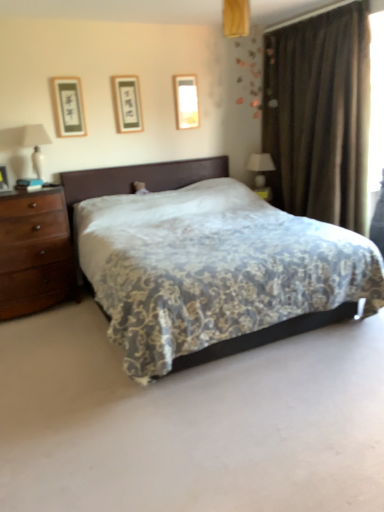
Describe the element at coordinates (208, 263) in the screenshot. I see `floral-patterned fabric bed at center` at that location.

From the picture: How much space does matte glass picture frame at upper center, arranged as the 1th picture frame when viewed from the right, occupy vertically?

It is 20.49 inches.

Locate an element on the screen. Image resolution: width=384 pixels, height=512 pixels. white ceramic table lamp at left, placed as the 1th table lamp when sorted from left to right is located at coordinates (35, 145).

Find the location of a particular element. The height and width of the screenshot is (512, 384). white glossy table lamp at upper right, which is counted as the second table lamp, starting from the left is located at coordinates (260, 167).

At what (x,y) coordinates should I click in order to perform the action: click on matte black picture frame at upper left, marked as the third picture frame in a right-to-left arrangement. Please return your answer as a coordinate pair (x, y). Looking at the image, I should click on (69, 106).

From the image's perspective, is white ceramic table lamp at left, which ranks as the first table lamp in front-to-back order, under floral-patterned fabric bed at center?

No, from the image's perspective, white ceramic table lamp at left, which ranks as the first table lamp in front-to-back order, is not beneath floral-patterned fabric bed at center.

How many degrees apart are the facing directions of white ceramic table lamp at left, the 2th table lamp from the back, and floral-patterned fabric bed at center?

The angular difference between white ceramic table lamp at left, the 2th table lamp from the back, and floral-patterned fabric bed at center is 3.81 degrees.

Is white ceramic table lamp at left, marked as the 2th table lamp in a right-to-left arrangement, oriented away from floral-patterned fabric bed at center?

white ceramic table lamp at left, marked as the 2th table lamp in a right-to-left arrangement, does not have its back to floral-patterned fabric bed at center.

Can you confirm if white ceramic table lamp at left, marked as the 2th table lamp in a right-to-left arrangement, is taller than floral-patterned fabric bed at center?

No.

Which object is further away from the camera, matte glass picture frame at upper center, arranged as the 1th picture frame when viewed from the right, or matte black picture frame at upper left, marked as the third picture frame in a right-to-left arrangement?

matte glass picture frame at upper center, arranged as the 1th picture frame when viewed from the right, is further from the camera.

Is matte glass picture frame at upper center, arranged as the 1th picture frame when viewed from the right, oriented away from matte black picture frame at upper left, marked as the third picture frame in a right-to-left arrangement?

matte glass picture frame at upper center, arranged as the 1th picture frame when viewed from the right, does not have its back to matte black picture frame at upper left, marked as the third picture frame in a right-to-left arrangement.

Measure the distance between matte glass picture frame at upper center, placed as the 3th picture frame when sorted from front to back, and matte black picture frame at upper left, marked as the third picture frame in a right-to-left arrangement.

matte glass picture frame at upper center, placed as the 3th picture frame when sorted from front to back, is 3.60 feet from matte black picture frame at upper left, marked as the third picture frame in a right-to-left arrangement.

From the image's perspective, which object appears higher, matte glass picture frame at upper center, arranged as the 1th picture frame when viewed from the right, or matte black picture frame at upper left, placed as the first picture frame when sorted from left to right?

matte glass picture frame at upper center, arranged as the 1th picture frame when viewed from the right, is shown above in the image.

Considering the sizes of objects black paper picture frame at upper center, placed as the 2th picture frame when sorted from left to right, and floral-patterned fabric bed at center in the image provided, who is bigger, black paper picture frame at upper center, placed as the 2th picture frame when sorted from left to right, or floral-patterned fabric bed at center?

floral-patterned fabric bed at center is bigger.

Are black paper picture frame at upper center, the 2th picture frame in the front-to-back sequence, and floral-patterned fabric bed at center far apart?

Yes.

Is point (130, 129) farther from viewer compared to point (202, 232)?

Yes, it is behind point (202, 232).

From a real-world perspective, is black paper picture frame at upper center, the 2th picture frame in the front-to-back sequence, above or below floral-patterned fabric bed at center?

black paper picture frame at upper center, the 2th picture frame in the front-to-back sequence, is above floral-patterned fabric bed at center.

Looking at the image, does matte black picture frame at upper left, marked as the third picture frame in a right-to-left arrangement, seem bigger or smaller compared to floral-patterned fabric bed at center?

matte black picture frame at upper left, marked as the third picture frame in a right-to-left arrangement, is smaller than floral-patterned fabric bed at center.

From a real-world perspective, which object stands above the other?

From a 3D spatial view, matte black picture frame at upper left, acting as the first picture frame starting from the front, is above.

Is point (85, 123) closer or farther from the camera than point (131, 309)?

Point (85, 123) is positioned farther from the camera compared to point (131, 309).

Is point (130, 88) in front of point (356, 207)?

No, (130, 88) is behind (356, 207).

Is brown velvet curtain at right inside black paper picture frame at upper center, the second picture frame viewed from the back?

No.

Which of these two, black paper picture frame at upper center, the 2th picture frame in the front-to-back sequence, or brown velvet curtain at right, is wider?

brown velvet curtain at right is wider.

From a real-world perspective, which is physically below, black paper picture frame at upper center, placed as the 2th picture frame when sorted from left to right, or brown velvet curtain at right?

brown velvet curtain at right is physically lower.

Considering the points (267, 156) and (95, 266), which point is behind, point (267, 156) or point (95, 266)?

The point (267, 156) is farther.

Is floral-patterned fabric bed at center at the back of white glossy table lamp at upper right, which is counted as the second table lamp, starting from the left?

No, white glossy table lamp at upper right, which is counted as the second table lamp, starting from the left, is not facing away from floral-patterned fabric bed at center.

In terms of height, does white glossy table lamp at upper right, which appears as the 2th table lamp when viewed from the front, look taller or shorter compared to floral-patterned fabric bed at center?

Clearly, white glossy table lamp at upper right, which appears as the 2th table lamp when viewed from the front, is shorter compared to floral-patterned fabric bed at center.

Who is more distant, white glossy table lamp at upper right, which appears as the 2th table lamp when viewed from the front, or floral-patterned fabric bed at center?

white glossy table lamp at upper right, which appears as the 2th table lamp when viewed from the front, is further from the camera.

From a real-world perspective, who is located lower, brown velvet curtain at right or white glossy table lamp at upper right, which is counted as the second table lamp, starting from the left?

From a 3D spatial view, white glossy table lamp at upper right, which is counted as the second table lamp, starting from the left, is below.

Is brown velvet curtain at right in contact with white glossy table lamp at upper right, which is counted as the second table lamp, starting from the left?

There is a gap between brown velvet curtain at right and white glossy table lamp at upper right, which is counted as the second table lamp, starting from the left.

Would you say brown velvet curtain at right is inside or outside white glossy table lamp at upper right, which is counted as the second table lamp, starting from the left?

A: brown velvet curtain at right is not inside white glossy table lamp at upper right, which is counted as the second table lamp, starting from the left, it's outside.

Which is closer to the camera, (311, 201) or (266, 153)?

Point (311, 201) is closer to the camera than point (266, 153).

Find the location of a particular element. This screenshot has width=384, height=512. bed that is under the white ceramic table lamp at left, marked as the 2th table lamp in a right-to-left arrangement (from a real-world perspective) is located at coordinates (208, 263).

What are the coordinates of `picture frame that is the 2nd object located below the matte glass picture frame at upper center, arranged as the 3th picture frame when viewed from the left (from the image's perspective)` in the screenshot? It's located at (69, 106).

When comparing their distances from brown velvet curtain at right, does matte black picture frame at upper left, marked as the third picture frame in a right-to-left arrangement, or white glossy table lamp at upper right, which is the first table lamp in right-to-left order, seem closer?

white glossy table lamp at upper right, which is the first table lamp in right-to-left order, is closer to brown velvet curtain at right.

Looking at the image, which one is located further to black paper picture frame at upper center, acting as the second picture frame starting from the right, floral-patterned fabric bed at center or matte glass picture frame at upper center, which is the 1th picture frame from back to front?

floral-patterned fabric bed at center lies further to black paper picture frame at upper center, acting as the second picture frame starting from the right, than the other object.

Estimate the real-world distances between objects in this image. Which object is closer to brown velvet curtain at right, white ceramic table lamp at left, which ranks as the first table lamp in front-to-back order, or matte black picture frame at upper left, placed as the first picture frame when sorted from left to right?

Based on the image, matte black picture frame at upper left, placed as the first picture frame when sorted from left to right, appears to be nearer to brown velvet curtain at right.

Based on their spatial positions, is white ceramic table lamp at left, which ranks as the first table lamp in front-to-back order, or black paper picture frame at upper center, the second picture frame viewed from the back, further from brown velvet curtain at right?

Among the two, white ceramic table lamp at left, which ranks as the first table lamp in front-to-back order, is located further to brown velvet curtain at right.

Based on their spatial positions, is brown velvet curtain at right or matte black picture frame at upper left, the 3th picture frame when ordered from back to front, further from white ceramic table lamp at left, which ranks as the first table lamp in front-to-back order?

Among the two, brown velvet curtain at right is located further to white ceramic table lamp at left, which ranks as the first table lamp in front-to-back order.

Estimate the real-world distances between objects in this image. Which object is closer to white ceramic table lamp at left, marked as the 2th table lamp in a right-to-left arrangement, matte glass picture frame at upper center, which is the 1th picture frame from back to front, or floral-patterned fabric bed at center?

Among the two, matte glass picture frame at upper center, which is the 1th picture frame from back to front, is located nearer to white ceramic table lamp at left, marked as the 2th table lamp in a right-to-left arrangement.

Based on their spatial positions, is matte glass picture frame at upper center, arranged as the 1th picture frame when viewed from the right, or floral-patterned fabric bed at center closer to matte black picture frame at upper left, marked as the third picture frame in a right-to-left arrangement?

matte glass picture frame at upper center, arranged as the 1th picture frame when viewed from the right, is closer to matte black picture frame at upper left, marked as the third picture frame in a right-to-left arrangement.

When comparing their distances from black paper picture frame at upper center, acting as the second picture frame starting from the right, does white ceramic table lamp at left, the 2th table lamp from the back, or brown velvet curtain at right seem closer?

white ceramic table lamp at left, the 2th table lamp from the back, is closer to black paper picture frame at upper center, acting as the second picture frame starting from the right.

You are a GUI agent. You are given a task and a screenshot of the screen. Output one action in this format:
    pyautogui.click(x=<x>, y=<y>)
    Task: Click on the table lamp between floral-patterned fabric bed at center and matte glass picture frame at upper center, arranged as the 1th picture frame when viewed from the right, from front to back
    
    Given the screenshot: What is the action you would take?
    (35, 145)

Image resolution: width=384 pixels, height=512 pixels. Identify the location of table lamp between floral-patterned fabric bed at center and white glossy table lamp at upper right, which is counted as the second table lamp, starting from the left, from front to back. (35, 145).

Identify the location of table lamp between matte black picture frame at upper left, marked as the third picture frame in a right-to-left arrangement, and brown velvet curtain at right. (260, 167).

This screenshot has height=512, width=384. I want to click on picture frame between floral-patterned fabric bed at center and black paper picture frame at upper center, acting as the second picture frame starting from the right, from front to back, so click(69, 106).